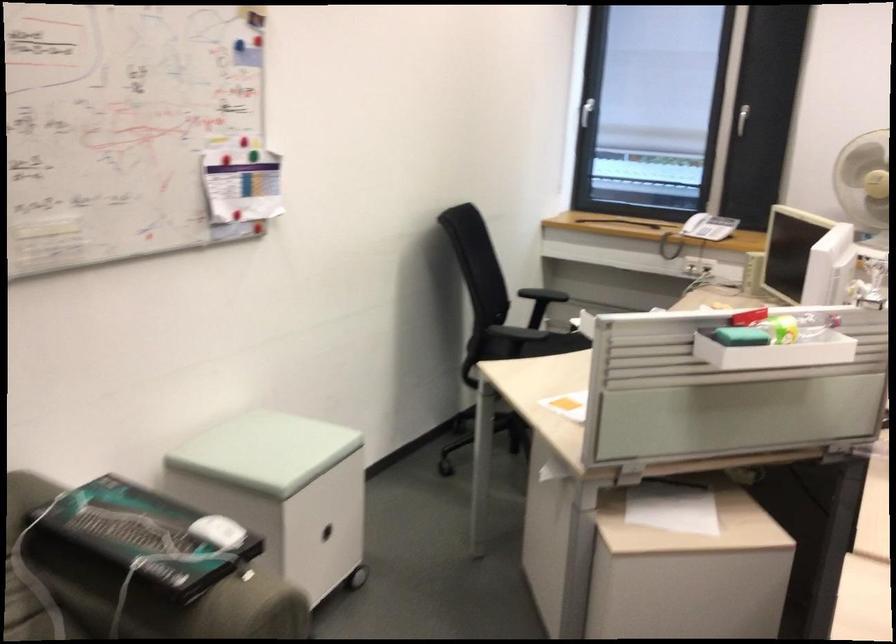
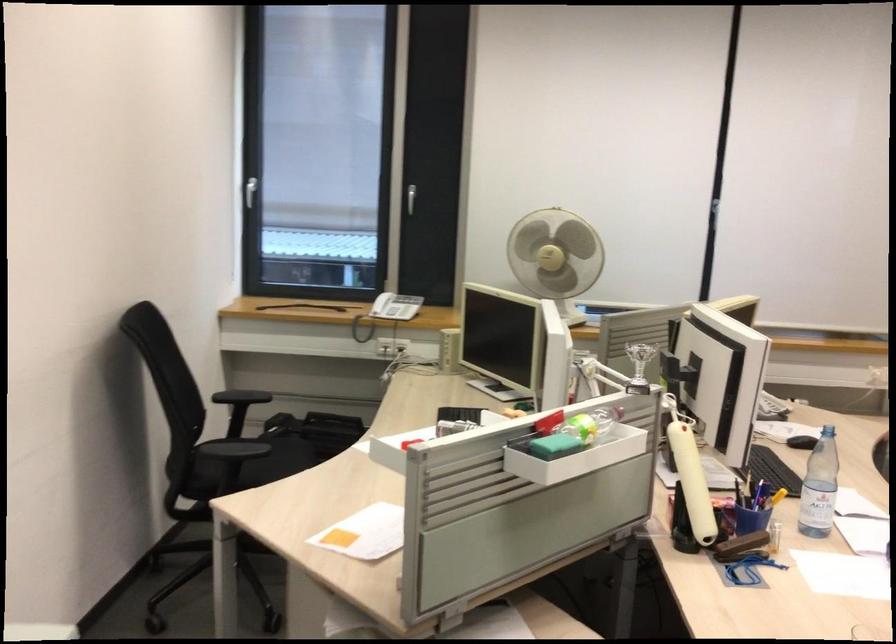
In a continuous first-person perspective shot, in which direction is the camera moving?

The cameraman moved toward left, forward.